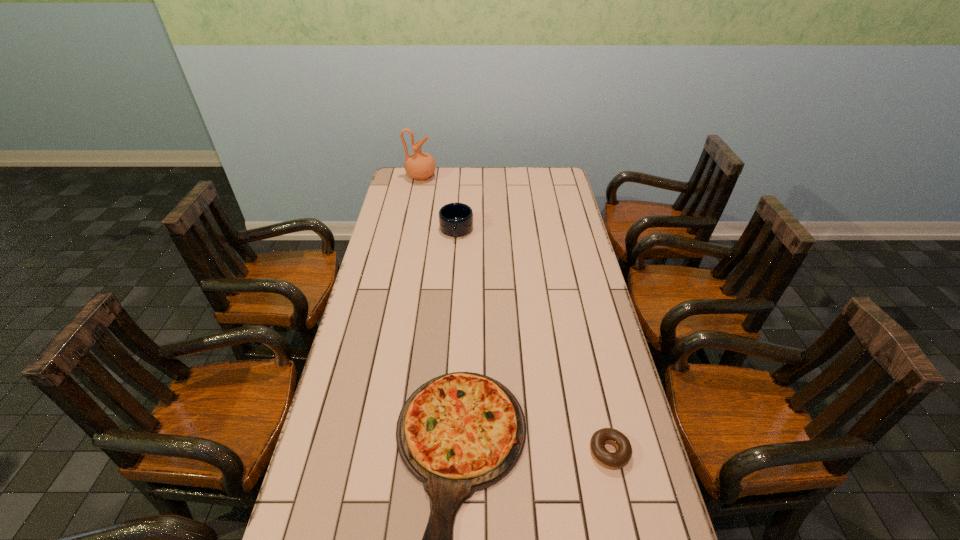
Locate an element on the screen. The width and height of the screenshot is (960, 540). free space between the mug and the farthest object is located at coordinates (439, 204).

What are the coordinates of `unoccupied position between the doughnut and the mug` in the screenshot? It's located at (533, 341).

Identify which object is the closest to the second tallest object. Please provide its 2D coordinates. Your answer should be formatted as a tuple, i.e. [(x, y)], where the tuple contains the x and y coordinates of a point satisfying the conditions above.

[(420, 165)]

You are a GUI agent. You are given a task and a screenshot of the screen. Output one action in this format:
    pyautogui.click(x=<x>, y=<y>)
    Task: Click on the object that stands as the closest to the mug
    
    Given the screenshot: What is the action you would take?
    pyautogui.click(x=420, y=165)

Locate an element on the screen. The height and width of the screenshot is (540, 960). vacant space that satisfies the following two spatial constraints: 1. with the handle on the side of the rightmost object; 2. on the left side of the second tallest object is located at coordinates (442, 451).

This screenshot has height=540, width=960. I want to click on vacant space that satisfies the following two spatial constraints: 1. with the handle on the side of the second farthest object; 2. on the right side of the shortest object, so [x=442, y=451].

Image resolution: width=960 pixels, height=540 pixels. What are the coordinates of `free location that satisfies the following two spatial constraints: 1. on the spout of the farthest object; 2. on the right side of the doughnut` in the screenshot? It's located at tap(367, 451).

You are a GUI agent. You are given a task and a screenshot of the screen. Output one action in this format:
    pyautogui.click(x=<x>, y=<y>)
    Task: Click on the free space that satisfies the following two spatial constraints: 1. on the back side of the shortest object; 2. on the spout of the pottery
    
    Given the screenshot: What is the action you would take?
    pyautogui.click(x=547, y=177)

The height and width of the screenshot is (540, 960). Find the location of `vacant region that satisfies the following two spatial constraints: 1. on the spout of the pottery; 2. on the left side of the shortest object`. vacant region that satisfies the following two spatial constraints: 1. on the spout of the pottery; 2. on the left side of the shortest object is located at coordinates (367, 451).

This screenshot has height=540, width=960. I want to click on vacant space that satisfies the following two spatial constraints: 1. on the spout of the pottery; 2. on the right side of the rightmost object, so click(367, 451).